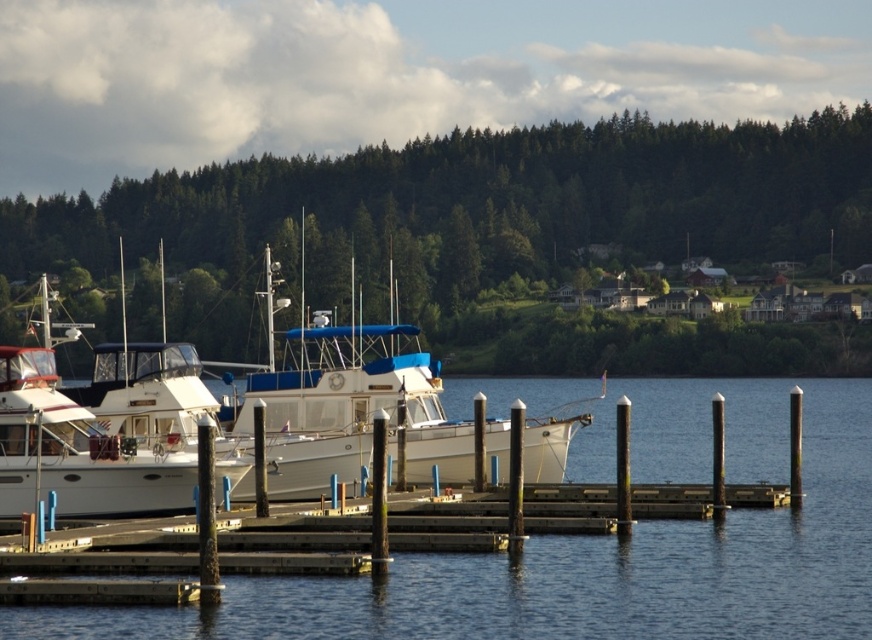
Between green leafy trees at upper center and clear blue water at center, which one has more height?

green leafy trees at upper center

In the scene shown: Does green leafy trees at upper center appear under clear blue water at center?

No, green leafy trees at upper center is not below clear blue water at center.

At what (x,y) coordinates should I click in order to perform the action: click on green leafy trees at upper center. Please return your answer as a coordinate pair (x, y). Image resolution: width=872 pixels, height=640 pixels. Looking at the image, I should click on (484, 241).

In the scene shown: Who is taller, clear blue water at center or white glossy boat at left?

white glossy boat at left is taller.

Which is behind, point (732, 468) or point (75, 476)?

Point (732, 468)

Which is in front, point (698, 573) or point (106, 483)?

Point (698, 573) is in front.

Where is `clear blue water at center`? This screenshot has width=872, height=640. clear blue water at center is located at coordinates (603, 547).

Is green leafy trees at upper center smaller than white glossy boat at left?

No.

Is green leafy trees at upper center taller than white glossy boat at left?

Yes, green leafy trees at upper center is taller than white glossy boat at left.

Does point (186, 234) come behind point (134, 508)?

Yes, point (186, 234) is behind point (134, 508).

Find the location of a particular element. green leafy trees at upper center is located at coordinates (484, 241).